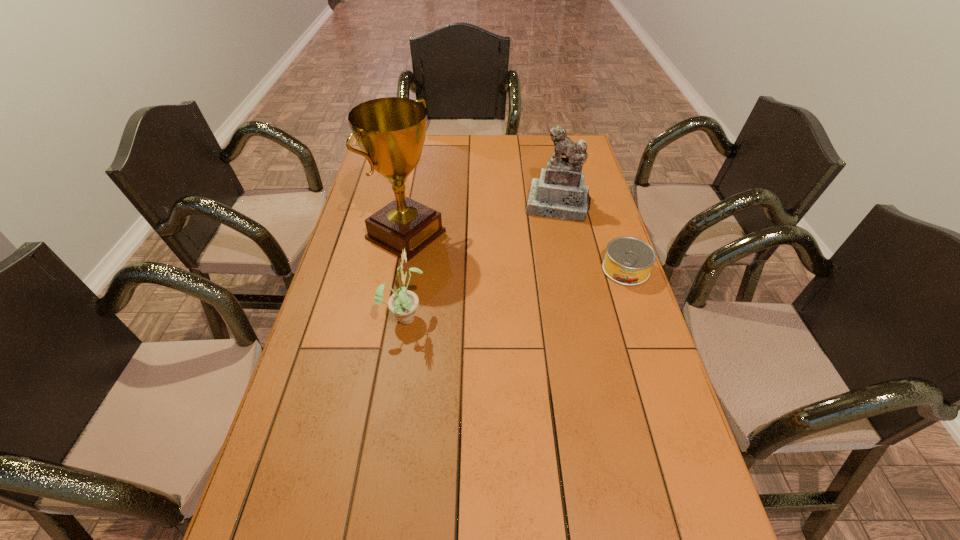
Identify the location of free area in between the nearest object and the figurine. This screenshot has height=540, width=960. tap(482, 261).

I want to click on empty space between the nearest object and the second tallest object, so click(x=482, y=261).

Identify the location of vacant region between the shortest object and the nearest object. (516, 293).

Image resolution: width=960 pixels, height=540 pixels. I want to click on free space between the can and the second shortest object, so click(516, 293).

This screenshot has width=960, height=540. I want to click on free space between the shortest object and the sunflower, so click(516, 293).

Locate an element on the screen. The width and height of the screenshot is (960, 540). free space between the shortest object and the second shortest object is located at coordinates (516, 293).

Where is `free space between the third shortest object and the sunflower`? free space between the third shortest object and the sunflower is located at coordinates (482, 261).

Identify the location of free spot between the tallest object and the third shortest object. Image resolution: width=960 pixels, height=540 pixels. (483, 220).

This screenshot has width=960, height=540. What are the coordinates of `object that stands as the second closest to the shortest object` in the screenshot? It's located at tap(390, 131).

Select which object is the second closest to the award. Please provide its 2D coordinates. Your answer should be formatted as a tuple, i.e. [(x, y)], where the tuple contains the x and y coordinates of a point satisfying the conditions above.

[(560, 193)]